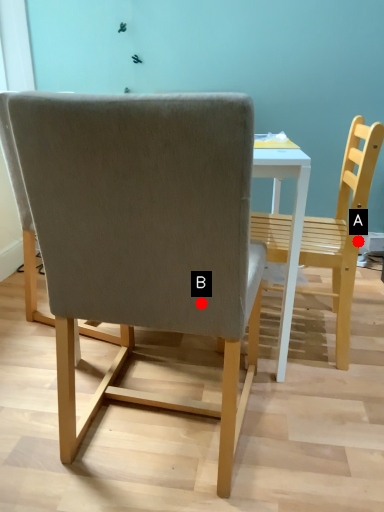
Question: Two points are circled on the image, labeled by A and B beside each circle. Which point is farther to the camera?

Choices:
 (A) A is further
 (B) B is further

Answer: (A)